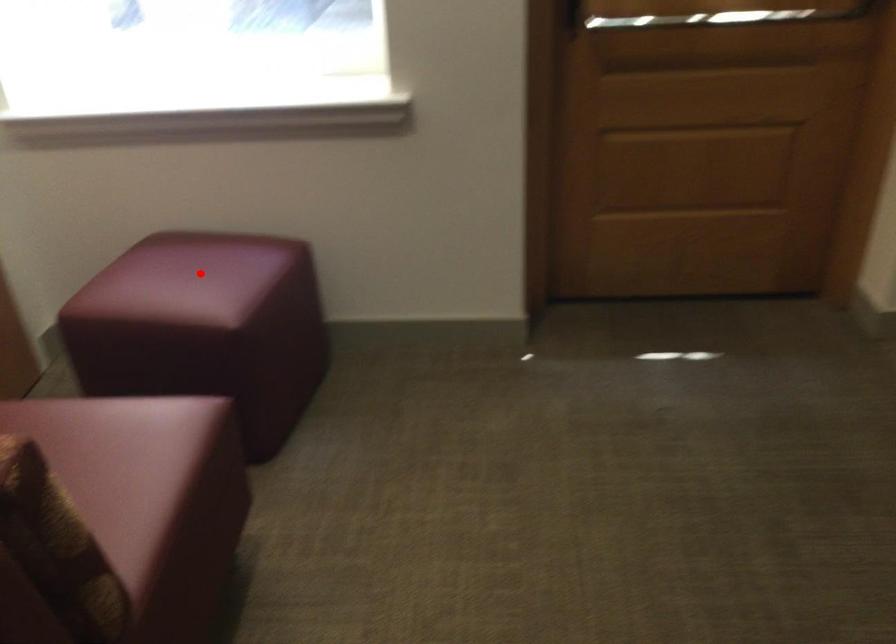
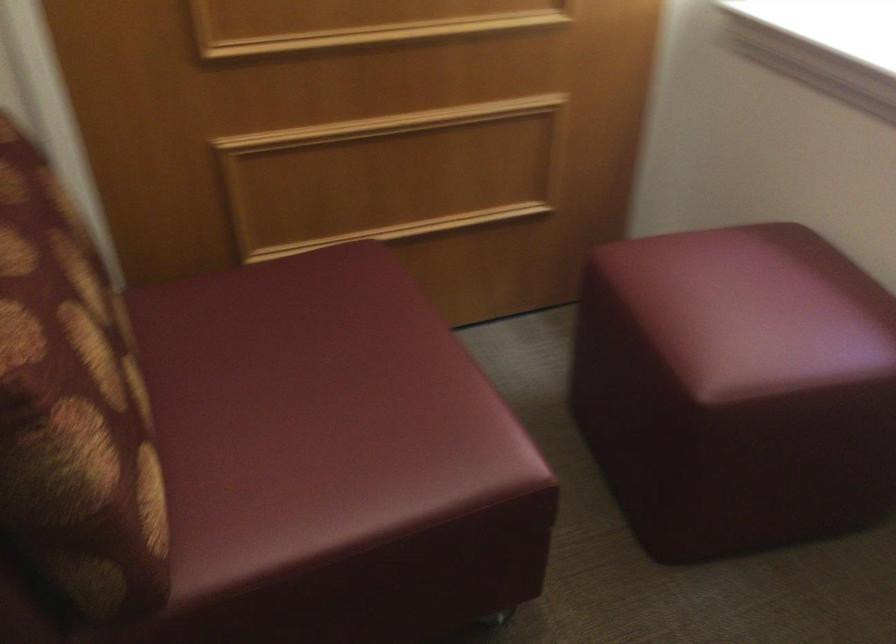
Question: I am providing you with two images of the same scene from different viewpoints. Given a red point in image1, look at the same physical point in image2. Is it:

Choices:
 (A) Closer to the viewpoint
 (B) Farther from the viewpoint

Answer: (A)